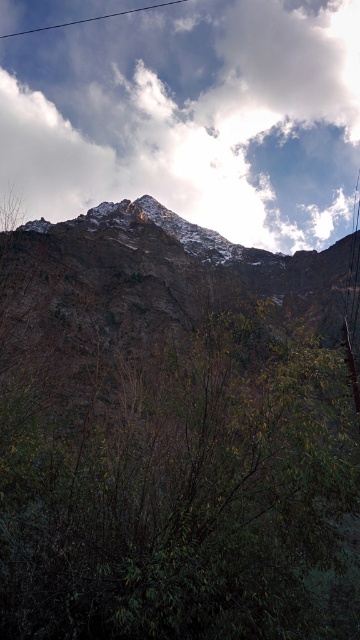
In the scene shown: You are standing at the bottom of the mountain looking up. Which direction should you walk to reach the green leafy tree at center?

The green leafy tree at center is located at point coordinates of (x=181, y=488), so you should walk towards the center of the scene to reach it.

Consider the image. You are standing in the mountain landscape and want to take a photo of the green leafy tree at center and the rugged stone mountain range at center. Which object will appear larger in the photo?

The green leafy tree at center will appear larger in the photo because it is closer to the viewer than the rugged stone mountain range at center.